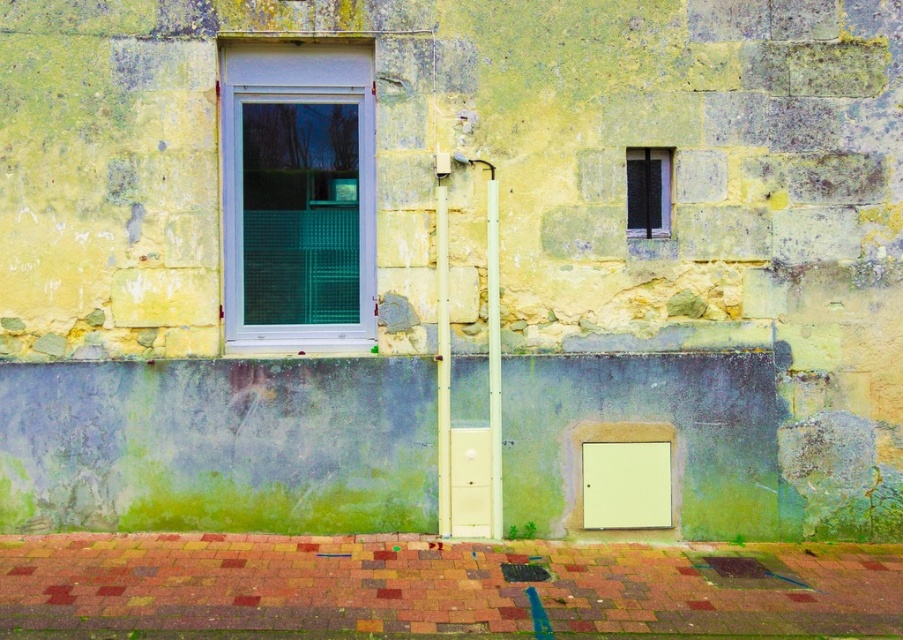
Consider the image. You are standing in front of the old building and notice two points marked on the wall. The first point is at coordinate point (498,348) and the second is at point (638,180). Which point is closer to you?

Point (498,348) is closer to the camera than point (638,180), so the first point is closer to you.

You are a maintenance worker needing to install a new sensor between the white plastic pole at center and the white plastic pipe at center. The sensor requires a minimum of 8 inches of space to function properly. Based on the image, can you confirm if there is enough space between them?

The distance between the white plastic pole at center and the white plastic pipe at center is 9.47 inches, which exceeds the required 8 inches. Therefore, there is enough space to install the sensor.